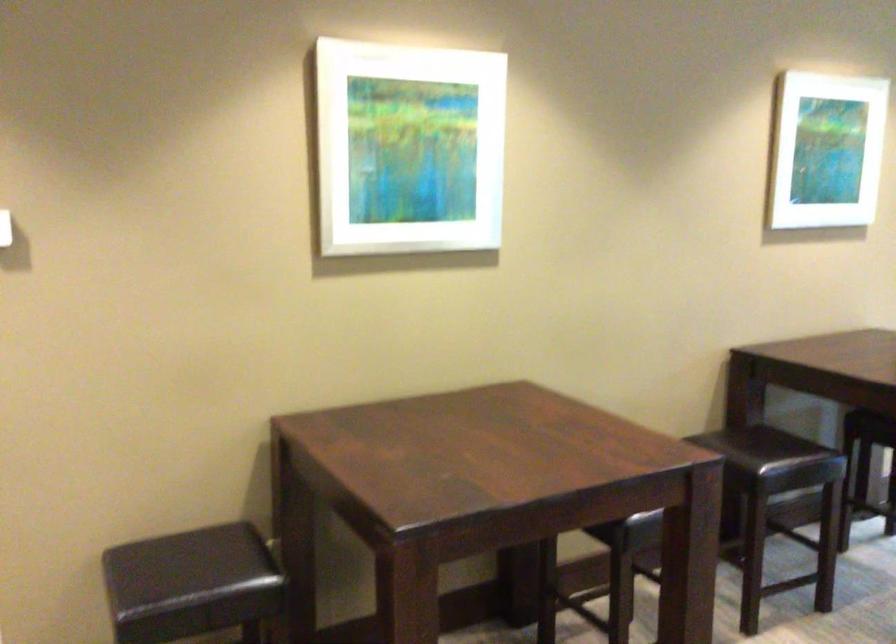
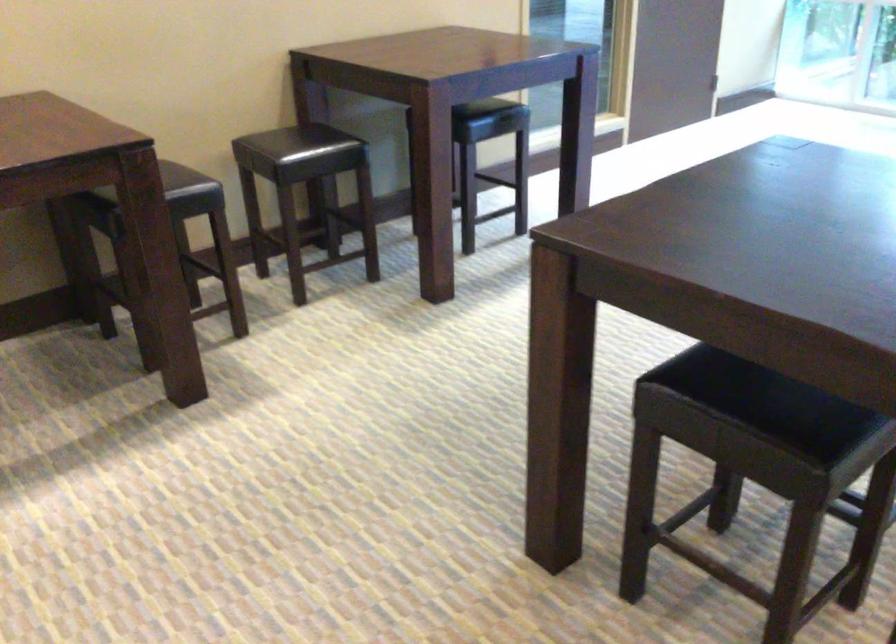
First-person continuous shooting, in which direction is the camera rotating?

The camera rotated toward right-down.